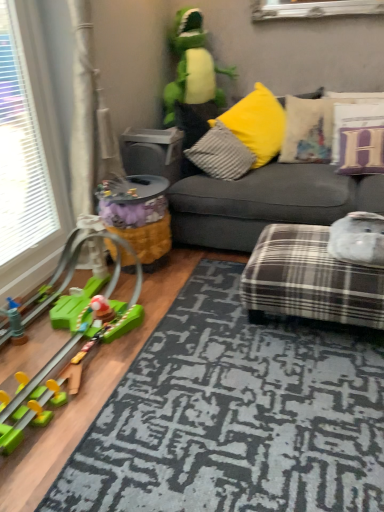
Question: Is gray textured pillow at center, which is the 1th pillow from left to right, aimed at green plush toy at upper center, positioned as the 1th toy in top-to-bottom order?

Choices:
 (A) yes
 (B) no

Answer: (B)

Question: Considering the relative positions of gray textured pillow at center, which is the 1th pillow from left to right, and green plush toy at upper center, which is the 3th toy from bottom to top, in the image provided, is gray textured pillow at center, which is the 1th pillow from left to right, to the left of green plush toy at upper center, which is the 3th toy from bottom to top, from the viewer's perspective?

Choices:
 (A) yes
 (B) no

Answer: (B)

Question: Is gray textured pillow at center, the 3th pillow from the right, to the right of green plush toy at upper center, positioned as the 1th toy in top-to-bottom order, from the viewer's perspective?

Choices:
 (A) yes
 (B) no

Answer: (A)

Question: Are gray textured pillow at center, which is the 1th pillow from left to right, and green plush toy at upper center, positioned as the 1th toy in top-to-bottom order, far apart?

Choices:
 (A) yes
 (B) no

Answer: (B)

Question: From the image's perspective, is gray textured pillow at center, which is the 1th pillow from left to right, located above green plush toy at upper center, positioned as the 1th toy in top-to-bottom order?

Choices:
 (A) yes
 (B) no

Answer: (B)

Question: From a real-world perspective, does gray textured pillow at center, which is the 1th pillow from left to right, sit lower than green plush toy at upper center, which is the 3th toy from bottom to top?

Choices:
 (A) no
 (B) yes

Answer: (B)

Question: Does plaid fabric ottoman at lower right, the first studio couch positioned from the bottom, have a greater width compared to yellow fabric toy at center, which is counted as the 2th toy, starting from the top?

Choices:
 (A) yes
 (B) no

Answer: (A)

Question: Can you confirm if plaid fabric ottoman at lower right, the first studio couch positioned from the bottom, is bigger than yellow fabric toy at center, placed as the second toy when sorted from bottom to top?

Choices:
 (A) yes
 (B) no

Answer: (A)

Question: Can you confirm if plaid fabric ottoman at lower right, positioned as the 2th studio couch in top-to-bottom order, is taller than yellow fabric toy at center, placed as the second toy when sorted from bottom to top?

Choices:
 (A) yes
 (B) no

Answer: (B)

Question: Is plaid fabric ottoman at lower right, positioned as the 2th studio couch in top-to-bottom order, aimed at yellow fabric toy at center, placed as the second toy when sorted from bottom to top?

Choices:
 (A) no
 (B) yes

Answer: (A)

Question: Is plaid fabric ottoman at lower right, the first studio couch positioned from the bottom, placed right next to yellow fabric toy at center, which is counted as the 2th toy, starting from the top?

Choices:
 (A) yes
 (B) no

Answer: (B)

Question: Does plaid fabric ottoman at lower right, positioned as the 2th studio couch in top-to-bottom order, have a lesser height compared to yellow fabric toy at center, which is counted as the 2th toy, starting from the top?

Choices:
 (A) yes
 (B) no

Answer: (A)

Question: Is velvet beige pillow at upper right, the second pillow viewed from the left, in front of yellow fabric toy at center, which is counted as the 2th toy, starting from the top?

Choices:
 (A) no
 (B) yes

Answer: (A)